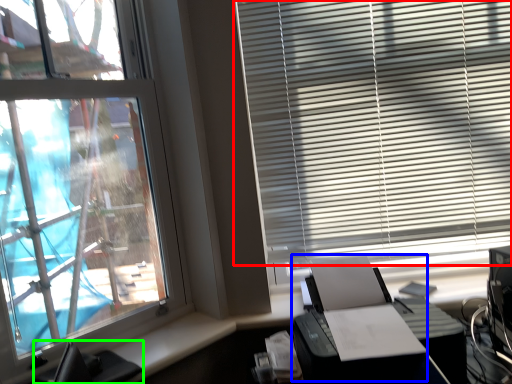
Question: Which object is the closest to the window blind (highlighted by a red box)? Choose among these: printer (highlighted by a blue box) or computer chair (highlighted by a green box).

Choices:
 (A) printer
 (B) computer chair

Answer: (A)